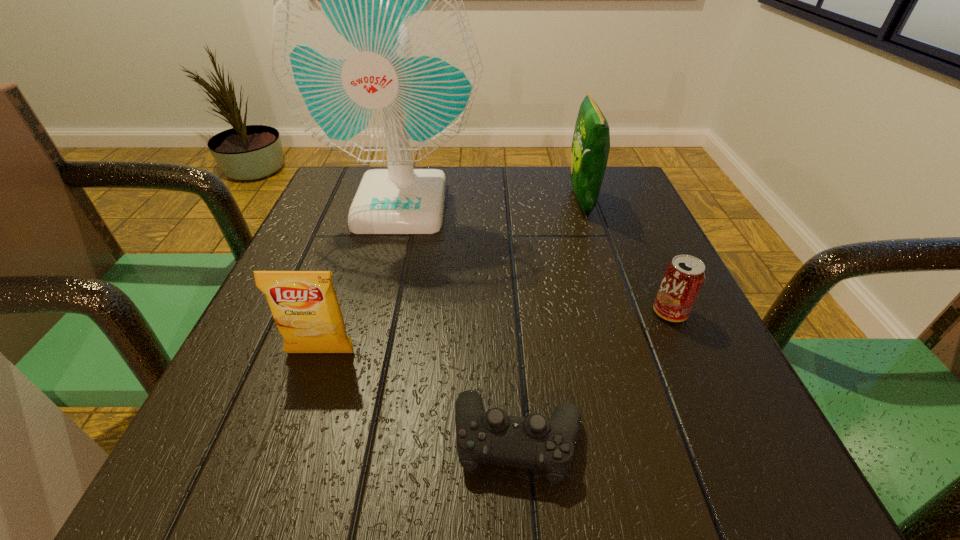
Locate an element on the screen. Image resolution: width=960 pixels, height=540 pixels. vacant point located between the tallest object and the right crisp (potato chip) is located at coordinates (492, 202).

Select which object is the third closest to the nearer crisp (potato chip). Please provide its 2D coordinates. Your answer should be formatted as a tuple, i.e. [(x, y)], where the tuple contains the x and y coordinates of a point satisfying the conditions above.

[(684, 276)]

Choose which object is the fourth nearest neighbor to the nearer crisp (potato chip). Please provide its 2D coordinates. Your answer should be formatted as a tuple, i.e. [(x, y)], where the tuple contains the x and y coordinates of a point satisfying the conditions above.

[(591, 141)]

At what (x,y) coordinates should I click in order to perform the action: click on vacant position in the image that satisfies the following two spatial constraints: 1. on the front-facing side of the farther crisp (potato chip); 2. on the front of the second nearest object with the logo. Please return your answer as a coordinate pair (x, y). Looking at the image, I should click on (631, 353).

Identify the location of vacant space that satisfies the following two spatial constraints: 1. on the front-facing side of the right crisp (potato chip); 2. on the back side of the rightmost object. This screenshot has height=540, width=960. 618,312.

Locate an element on the screen. free space that satisfies the following two spatial constraints: 1. on the front-facing side of the right crisp (potato chip); 2. on the front of the nearer crisp (potato chip) with the logo is located at coordinates (631, 353).

Identify the location of free space in the image that satisfies the following two spatial constraints: 1. on the back side of the fourth tallest object; 2. on the left side of the shortest object. (509, 312).

Where is `vacant point that satisfies the following two spatial constraints: 1. on the front-facing side of the fourth shortest object; 2. on the front of the nearer crisp (potato chip) with the logo`? The image size is (960, 540). vacant point that satisfies the following two spatial constraints: 1. on the front-facing side of the fourth shortest object; 2. on the front of the nearer crisp (potato chip) with the logo is located at coordinates (631, 353).

Where is `vacant space that satisfies the following two spatial constraints: 1. on the front-facing side of the fourth tallest object; 2. on the right side of the taller crisp (potato chip)`? vacant space that satisfies the following two spatial constraints: 1. on the front-facing side of the fourth tallest object; 2. on the right side of the taller crisp (potato chip) is located at coordinates (618, 312).